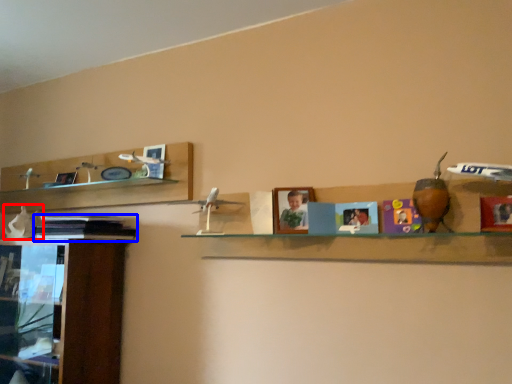
Question: Among these objects, which one is nearest to the camera, toy (highlighted by a red box) or book (highlighted by a blue box)?

Choices:
 (A) toy
 (B) book

Answer: (B)